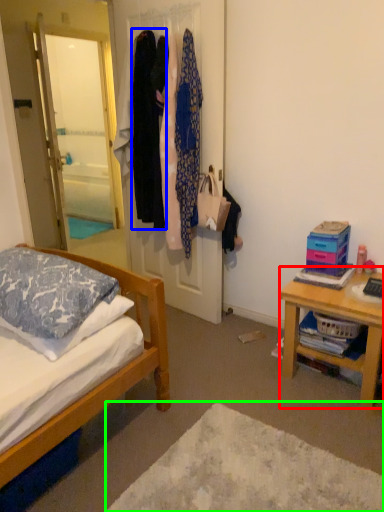
Question: Which object is positioned closest to desk (highlighted by a red box)? Select from clothing (highlighted by a blue box) and plain (highlighted by a green box).

Choices:
 (A) clothing
 (B) plain

Answer: (B)